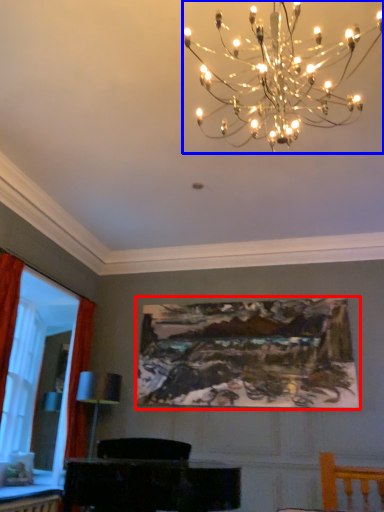
Question: Which object appears farthest to the camera in this image, picture frame (highlighted by a red box) or lamp (highlighted by a blue box)?

Choices:
 (A) picture frame
 (B) lamp

Answer: (A)